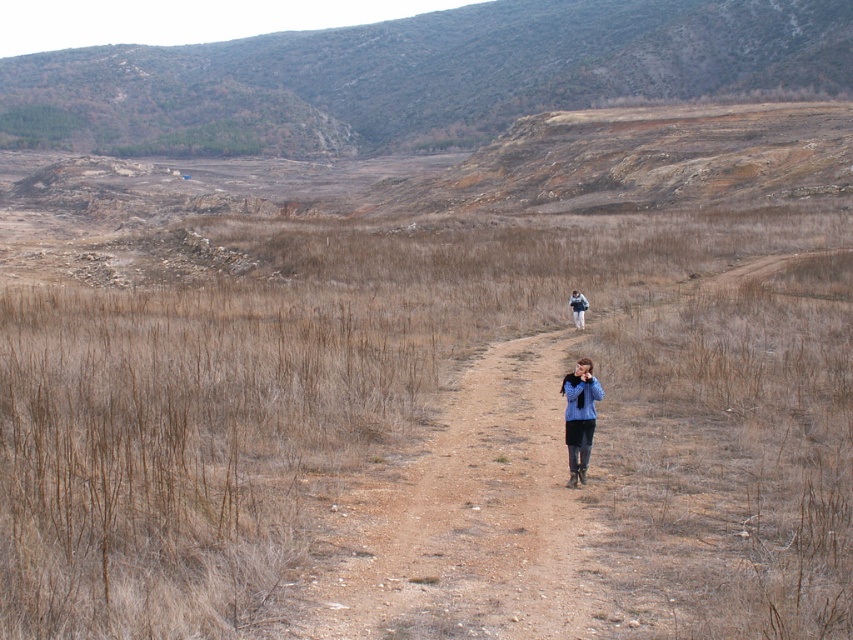
You are a hiker trying to take a photo of the blue fabric jacket at center from the brown dry grass at center. Is the jacket visible from the grass?

The brown dry grass at center is located above the blue fabric jacket at center, so the jacket is visible from the grass as the grass is above it.

You are standing at the point marked by the coordinates point (425, 410). Looking around, you see brown dry grass at center. What is the terrain like directly beneath your feet?

The terrain directly beneath your feet at point (425, 410) is brown dry grass at center.